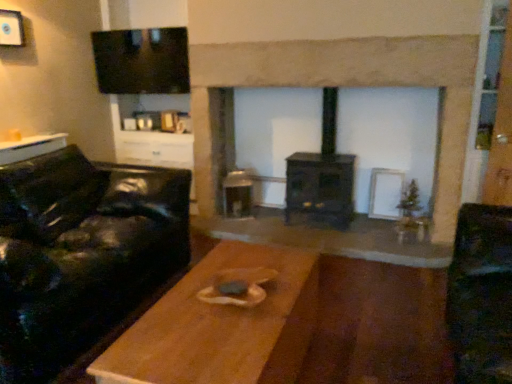
Question: Based on their sizes in the image, would you say dark wood fireplace at center is bigger or smaller than black leather couch at left?

Choices:
 (A) big
 (B) small

Answer: (A)

Question: Does point (440, 51) appear closer or farther from the camera than point (141, 200)?

Choices:
 (A) closer
 (B) farther

Answer: (B)

Question: Estimate the real-world distances between objects in this image. Which object is farther from the black matte wood burning stove at center?

Choices:
 (A) dark wood fireplace at center
 (B) black leather couch at left
 (C) white matte picture frame at upper left
 (D) wooden table at center, which is the first table from right to left
 (E) wooden table at left, the 1th table positioned from the top

Answer: (C)

Question: Which is nearer to the wooden table at center, which is the first table from right to left?

Choices:
 (A) white matte picture frame at upper left
 (B) dark wood fireplace at center
 (C) black leather couch at left
 (D) black matte wood burning stove at center
 (E) wooden table at left, the 1th table positioned from the top

Answer: (C)